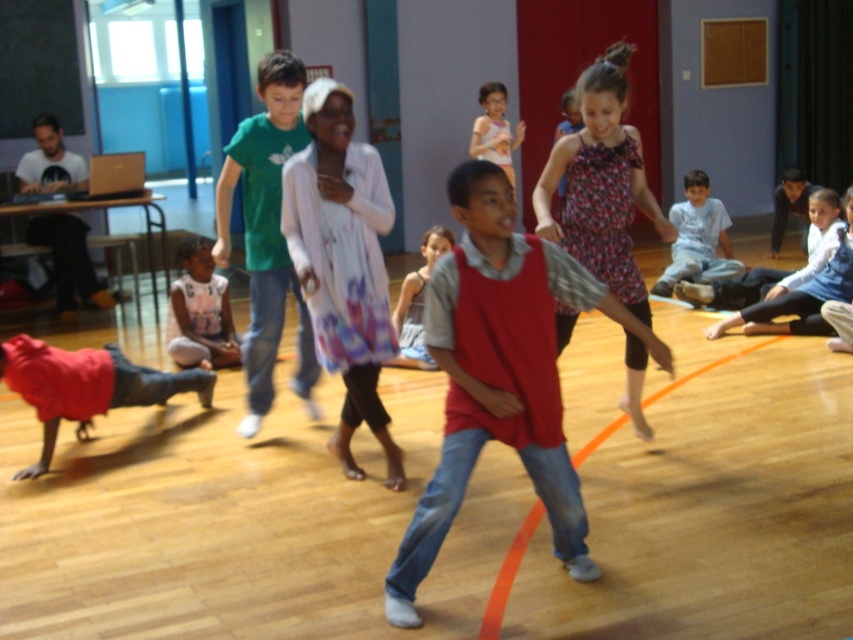
Question: Is green cotton t-shirt at center smaller than light blue cotton shirt at center?

Choices:
 (A) yes
 (B) no

Answer: (A)

Question: Which point is closer to the camera?

Choices:
 (A) white cotton shirt at upper center
 (B) red cotton vest at center

Answer: (B)

Question: Among these objects, which one is nearest to the camera?

Choices:
 (A) white cotton shirt at upper center
 (B) red cotton vest at center

Answer: (B)

Question: Can you confirm if white cotton shirt at lower left is positioned below light blue denim shorts at center?

Choices:
 (A) yes
 (B) no

Answer: (A)

Question: Can you confirm if white cotton shirt at lower left is smaller than light blue cotton shirt at center?

Choices:
 (A) no
 (B) yes

Answer: (B)

Question: Which point is closer to the camera taking this photo?

Choices:
 (A) (492, 150)
 (B) (685, 209)
 (C) (171, 332)
 (D) (631, 380)

Answer: (D)